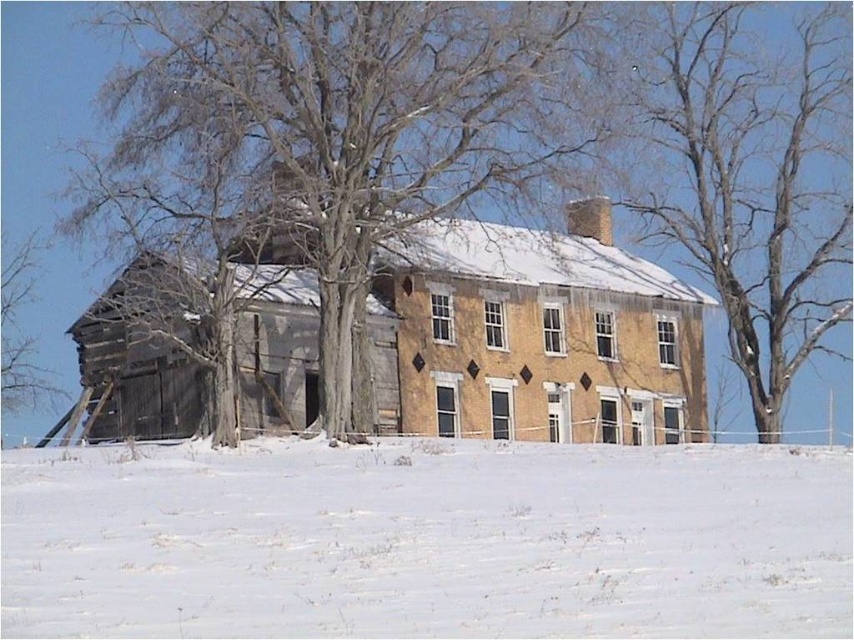
Question: Which of the following is the farthest from the observer?

Choices:
 (A) (28, 264)
 (B) (206, 141)
 (C) (829, 506)

Answer: (A)

Question: Among these objects, which one is nearest to the camera?

Choices:
 (A) bare wood tree at center
 (B) white powdery snow at lower center

Answer: (B)

Question: Where is white powdery snow at lower center located in relation to bare wood tree at left in the image?

Choices:
 (A) above
 (B) below

Answer: (B)

Question: Does white powdery snow at lower center appear over bare wood tree at left?

Choices:
 (A) yes
 (B) no

Answer: (B)

Question: Where is white powdery snow at lower center located in relation to bare wood tree at center in the image?

Choices:
 (A) left
 (B) right

Answer: (B)

Question: Which of the following is the farthest from the observer?

Choices:
 (A) (199, 168)
 (B) (34, 476)
 (C) (688, 104)

Answer: (C)